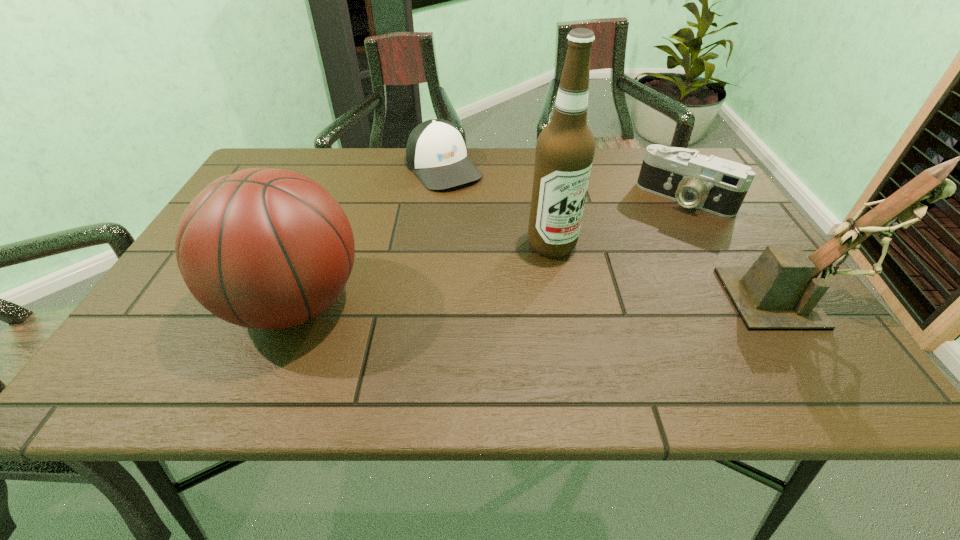
The image size is (960, 540). In order to click on the leftmost object in this screenshot , I will do `click(264, 248)`.

At what (x,y) coordinates should I click in order to perform the action: click on figurine. Please return your answer as a coordinate pair (x, y). This screenshot has height=540, width=960. Looking at the image, I should click on (781, 290).

Find the location of a particular element. The image size is (960, 540). cap is located at coordinates (436, 152).

Where is `camera`? The height and width of the screenshot is (540, 960). camera is located at coordinates (715, 185).

Identify the location of the third object from left to right. This screenshot has height=540, width=960. (565, 148).

This screenshot has height=540, width=960. I want to click on the tallest object, so click(565, 148).

You are a GUI agent. You are given a task and a screenshot of the screen. Output one action in this format:
    pyautogui.click(x=<x>, y=<y>)
    Task: Click on the vacant point located on the back of the basketball
    
    Given the screenshot: What is the action you would take?
    pyautogui.click(x=339, y=195)

Where is `vacant space located 0.220m on the front panel of the cap`? The width and height of the screenshot is (960, 540). vacant space located 0.220m on the front panel of the cap is located at coordinates (501, 234).

Find the location of a particular element. Image resolution: width=960 pixels, height=540 pixels. vacant space situated on the front panel of the cap is located at coordinates (499, 232).

Where is `vacant space located on the front panel of the cap`? The width and height of the screenshot is (960, 540). vacant space located on the front panel of the cap is located at coordinates (493, 225).